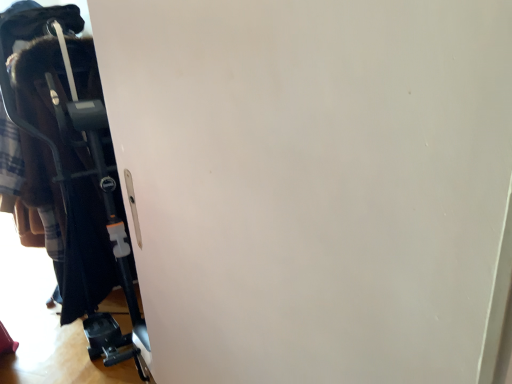
What do you see at coordinates (82, 194) in the screenshot?
I see `black plastic baby carriage at left` at bounding box center [82, 194].

Measure the distance between black plastic baby carriage at left and camera.

5.33 feet.

Identify the location of black plastic baby carriage at left. (82, 194).

This screenshot has height=384, width=512. In order to click on black plastic baby carriage at left in this screenshot , I will do `click(82, 194)`.